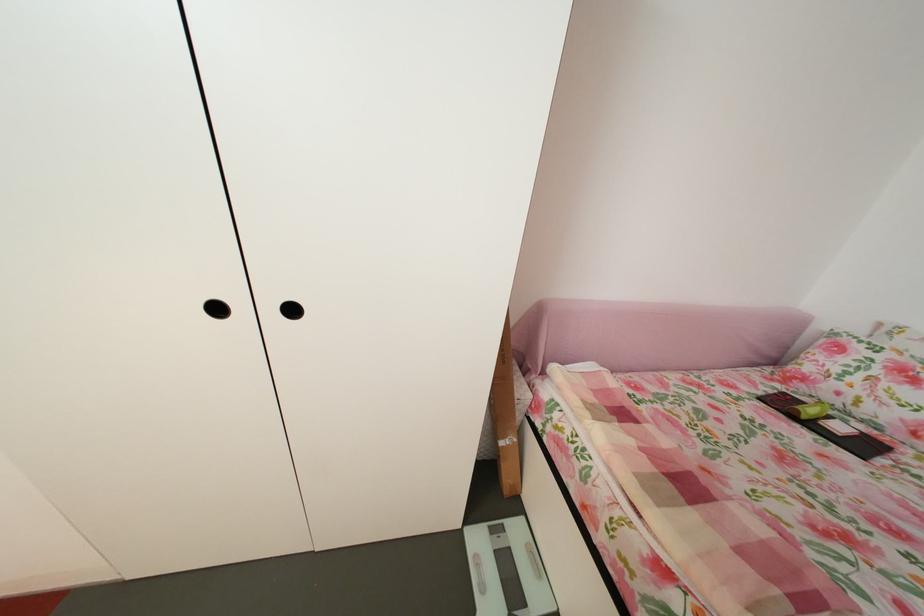
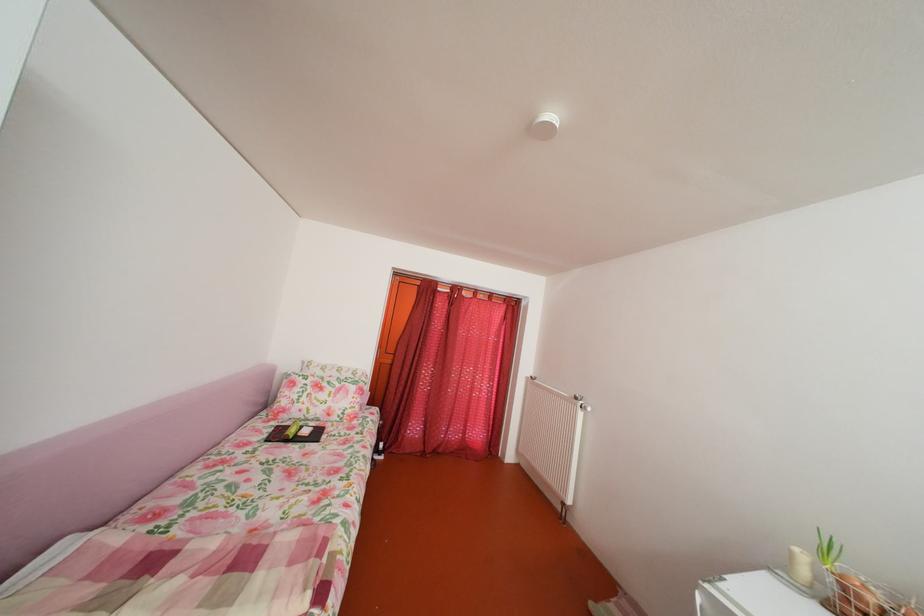
In the second image, find the point that corresponds to pixel 820 418 in the first image.

(304, 438)